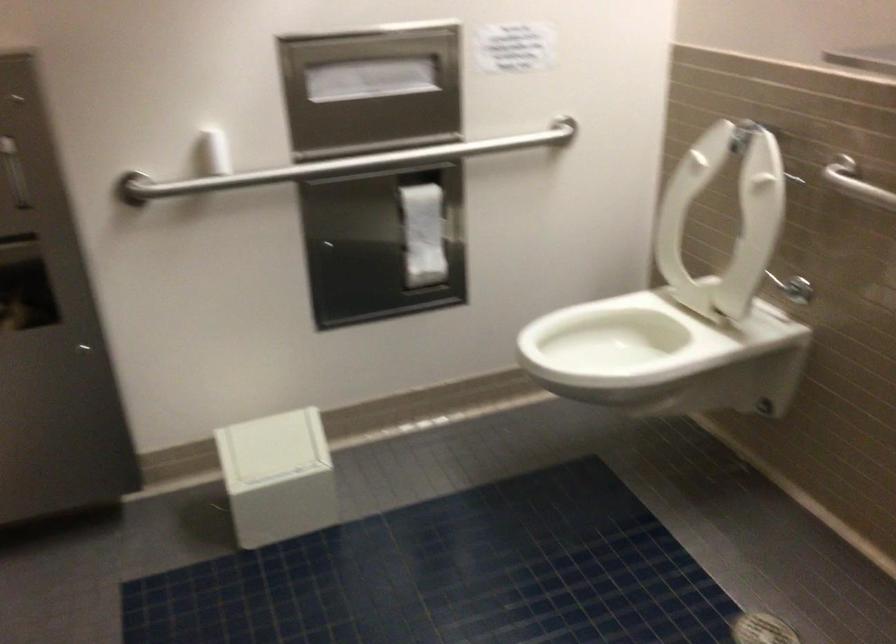
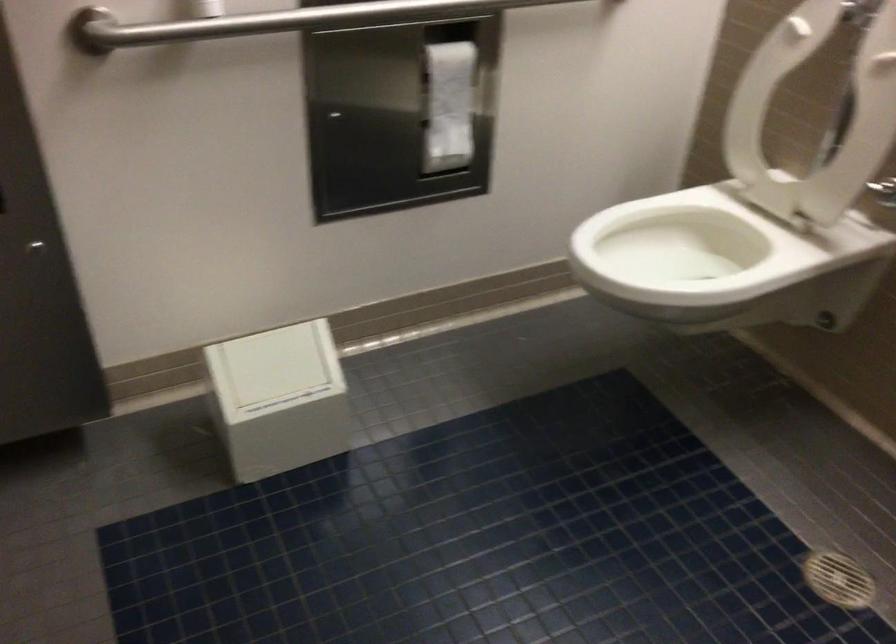
In the second image, find the point that corresponds to (x=736, y=229) in the first image.

(814, 115)